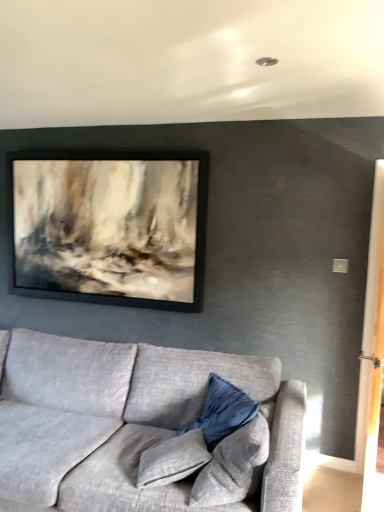
Question: Considering the relative sizes of velvet blue pillow at lower center, the 1th pillow in the front-to-back sequence, and velvet blue pillow at center, placed as the 1th pillow when sorted from back to front, in the image provided, is velvet blue pillow at lower center, the 1th pillow in the front-to-back sequence, shorter than velvet blue pillow at center, placed as the 1th pillow when sorted from back to front,?

Choices:
 (A) yes
 (B) no

Answer: (B)

Question: From the image's perspective, is velvet blue pillow at lower center, the 2th pillow viewed from the back, below velvet blue pillow at center, placed as the 1th pillow when sorted from back to front?

Choices:
 (A) yes
 (B) no

Answer: (B)

Question: Considering the relative sizes of velvet blue pillow at lower center, the 2th pillow viewed from the back, and velvet blue pillow at center, arranged as the 2th pillow when viewed from the front, in the image provided, is velvet blue pillow at lower center, the 2th pillow viewed from the back, smaller than velvet blue pillow at center, arranged as the 2th pillow when viewed from the front,?

Choices:
 (A) yes
 (B) no

Answer: (B)

Question: Does velvet blue pillow at lower center, the 1th pillow in the front-to-back sequence, lie in front of velvet blue pillow at center, placed as the 1th pillow when sorted from back to front?

Choices:
 (A) no
 (B) yes

Answer: (B)

Question: Is velvet blue pillow at lower center, the 2th pillow viewed from the back, at the left side of velvet blue pillow at center, arranged as the 2th pillow when viewed from the front?

Choices:
 (A) yes
 (B) no

Answer: (B)

Question: Choose the correct answer: Is textured gray couch at lower left inside velvet blue pillow at lower center, the 1th pillow in the front-to-back sequence, or outside it?

Choices:
 (A) inside
 (B) outside

Answer: (B)

Question: In terms of height, does textured gray couch at lower left look taller or shorter compared to velvet blue pillow at lower center, the 1th pillow in the front-to-back sequence?

Choices:
 (A) tall
 (B) short

Answer: (A)

Question: Considering the positions of textured gray couch at lower left and velvet blue pillow at lower center, the 1th pillow in the front-to-back sequence, in the image, is textured gray couch at lower left bigger or smaller than velvet blue pillow at lower center, the 1th pillow in the front-to-back sequence,?

Choices:
 (A) big
 (B) small

Answer: (A)

Question: Is textured gray couch at lower left wider or thinner than velvet blue pillow at lower center, the 1th pillow in the front-to-back sequence?

Choices:
 (A) thin
 (B) wide

Answer: (B)

Question: Based on their positions, is textured gray couch at lower left located to the left or right of velvet blue pillow at center, placed as the 1th pillow when sorted from back to front?

Choices:
 (A) right
 (B) left

Answer: (B)

Question: Is textured gray couch at lower left inside the boundaries of velvet blue pillow at center, placed as the 1th pillow when sorted from back to front, or outside?

Choices:
 (A) outside
 (B) inside

Answer: (A)

Question: Is textured gray couch at lower left in front of or behind velvet blue pillow at center, placed as the 1th pillow when sorted from back to front, in the image?

Choices:
 (A) behind
 (B) front

Answer: (B)

Question: From their relative heights in the image, would you say textured gray couch at lower left is taller or shorter than velvet blue pillow at center, arranged as the 2th pillow when viewed from the front?

Choices:
 (A) short
 (B) tall

Answer: (B)

Question: Considering the relative positions of velvet blue pillow at lower center, the 2th pillow viewed from the back, and velvet blue pillow at center, placed as the 1th pillow when sorted from back to front, in the image provided, is velvet blue pillow at lower center, the 2th pillow viewed from the back, to the left or to the right of velvet blue pillow at center, placed as the 1th pillow when sorted from back to front,?

Choices:
 (A) right
 (B) left

Answer: (A)

Question: In terms of size, does velvet blue pillow at lower center, the 1th pillow in the front-to-back sequence, appear bigger or smaller than velvet blue pillow at center, arranged as the 2th pillow when viewed from the front?

Choices:
 (A) small
 (B) big

Answer: (B)